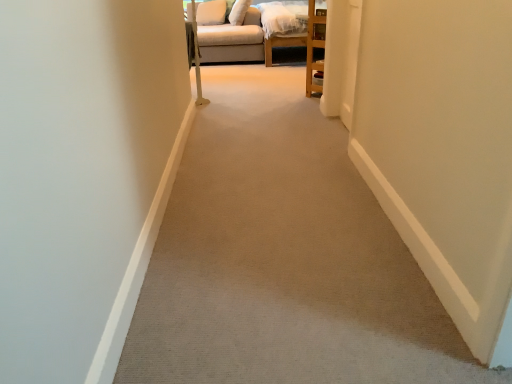
This screenshot has height=384, width=512. Find the location of `beige fabric couch at upper center`. beige fabric couch at upper center is located at coordinates (246, 48).

What is the approximate height of beige fabric couch at upper center?

beige fabric couch at upper center is 67.98 centimeters in height.

What do you see at coordinates (210, 12) in the screenshot?
I see `white fabric pillow at upper center, the second pillow viewed from the right` at bounding box center [210, 12].

In order to face beige carpet at center, should I rotate leftwards or rightwards?

To face it directly, rotate right by 2.169 degrees.

This screenshot has width=512, height=384. What do you see at coordinates (283, 258) in the screenshot?
I see `beige carpet at center` at bounding box center [283, 258].

I want to click on beige fabric couch at upper center, so click(x=246, y=48).

Choose the correct answer: Is beige fabric pillow at upper center, marked as the 2th pillow in a left-to-right arrangement, inside beige carpet at center or outside it?

beige fabric pillow at upper center, marked as the 2th pillow in a left-to-right arrangement, is spatially situated outside beige carpet at center.

Is beige fabric pillow at upper center, marked as the 2th pillow in a left-to-right arrangement, positioned in front of beige carpet at center?

No, it is behind beige carpet at center.

Does beige fabric pillow at upper center, which is the 1th pillow in right-to-left order, have a lesser width compared to beige carpet at center?

Yes, beige fabric pillow at upper center, which is the 1th pillow in right-to-left order, is thinner than beige carpet at center.

Which is more to the left, beige fabric pillow at upper center, marked as the 2th pillow in a left-to-right arrangement, or beige carpet at center?

beige fabric pillow at upper center, marked as the 2th pillow in a left-to-right arrangement, is more to the left.

Would you say white fabric pillow at upper center, the second pillow viewed from the right, is to the left or to the right of beige fabric pillow at upper center, marked as the 2th pillow in a left-to-right arrangement, in the picture?

white fabric pillow at upper center, the second pillow viewed from the right, is positioned on beige fabric pillow at upper center, marked as the 2th pillow in a left-to-right arrangement,'s left side.

Is white fabric pillow at upper center, marked as the 1th pillow in a left-to-right arrangement, situated inside beige fabric pillow at upper center, marked as the 2th pillow in a left-to-right arrangement, or outside?

white fabric pillow at upper center, marked as the 1th pillow in a left-to-right arrangement, is outside beige fabric pillow at upper center, marked as the 2th pillow in a left-to-right arrangement.

Identify the location of pillow below the beige fabric pillow at upper center, marked as the 2th pillow in a left-to-right arrangement (from a real-world perspective). The image size is (512, 384). (210, 12).

In the image, is white fabric pillow at upper center, marked as the 1th pillow in a left-to-right arrangement, positioned in front of or behind beige fabric pillow at upper center, marked as the 2th pillow in a left-to-right arrangement?

white fabric pillow at upper center, marked as the 1th pillow in a left-to-right arrangement, is positioned farther from the viewer than beige fabric pillow at upper center, marked as the 2th pillow in a left-to-right arrangement.

Starting from the beige carpet at center, which pillow is the 1st one to the left? Please provide its 2D coordinates.

[(239, 12)]

Between beige carpet at center and beige fabric pillow at upper center, marked as the 2th pillow in a left-to-right arrangement, which one has smaller size?

beige fabric pillow at upper center, marked as the 2th pillow in a left-to-right arrangement, is smaller.

Considering the points (215, 205) and (240, 3), which point is in front, point (215, 205) or point (240, 3)?

The point (215, 205) is more forward.

Would you say beige carpet at center is to the left or to the right of beige fabric pillow at upper center, marked as the 2th pillow in a left-to-right arrangement, in the picture?

From the image, it's evident that beige carpet at center is to the right of beige fabric pillow at upper center, marked as the 2th pillow in a left-to-right arrangement.

Does beige carpet at center contain beige fabric couch at upper center?

Actually, beige fabric couch at upper center is outside beige carpet at center.

In the scene shown: From a real-world perspective, is beige carpet at center physically located above or below beige fabric couch at upper center?

In terms of real-world spatial position, beige carpet at center is below beige fabric couch at upper center.

Considering the positions of objects beige carpet at center and beige fabric couch at upper center in the image provided, who is in front, beige carpet at center or beige fabric couch at upper center?

beige carpet at center is in front.

Is beige fabric couch at upper center at the back of beige carpet at center?

That's not correct — beige carpet at center is not looking away from beige fabric couch at upper center.

Which of these two, beige fabric couch at upper center or beige fabric pillow at upper center, marked as the 2th pillow in a left-to-right arrangement, is thinner?

Thinner between the two is beige fabric pillow at upper center, marked as the 2th pillow in a left-to-right arrangement.

From the image's perspective, would you say beige fabric couch at upper center is shown under beige fabric pillow at upper center, marked as the 2th pillow in a left-to-right arrangement?

Indeed, from the image's perspective, beige fabric couch at upper center is shown beneath beige fabric pillow at upper center, marked as the 2th pillow in a left-to-right arrangement.

Visually, is beige fabric couch at upper center positioned to the left or to the right of beige fabric pillow at upper center, marked as the 2th pillow in a left-to-right arrangement?

Based on their positions, beige fabric couch at upper center is located to the left of beige fabric pillow at upper center, marked as the 2th pillow in a left-to-right arrangement.

Is beige fabric couch at upper center bigger than beige fabric pillow at upper center, marked as the 2th pillow in a left-to-right arrangement?

Yes.

Is point (298, 37) less distant than point (234, 325)?

That is False.

Looking at this image, from their relative heights in the image, would you say beige fabric couch at upper center is taller or shorter than beige carpet at center?

Clearly, beige fabric couch at upper center is taller compared to beige carpet at center.

Is beige fabric couch at upper center placed right next to beige carpet at center?

No, beige fabric couch at upper center is not next to beige carpet at center.

Identify the location of path below the beige fabric couch at upper center (from the image's perspective). Image resolution: width=512 pixels, height=384 pixels. (283, 258).

Can you confirm if white fabric pillow at upper center, marked as the 1th pillow in a left-to-right arrangement, is bigger than beige fabric couch at upper center?

Actually, white fabric pillow at upper center, marked as the 1th pillow in a left-to-right arrangement, might be smaller than beige fabric couch at upper center.

How many degrees apart are the facing directions of white fabric pillow at upper center, marked as the 1th pillow in a left-to-right arrangement, and beige fabric couch at upper center?

78.1 degrees.

Considering the positions of points (199, 15) and (318, 52), is point (199, 15) farther from camera compared to point (318, 52)?

That is True.

Looking at their sizes, would you say white fabric pillow at upper center, the second pillow viewed from the right, is wider or thinner than beige fabric couch at upper center?

Clearly, white fabric pillow at upper center, the second pillow viewed from the right, has less width compared to beige fabric couch at upper center.

Locate an element on the screen. This screenshot has width=512, height=384. path on the right side of beige fabric pillow at upper center, marked as the 2th pillow in a left-to-right arrangement is located at coordinates (283, 258).

In order to click on pillow that is above the white fabric pillow at upper center, marked as the 1th pillow in a left-to-right arrangement (from a real-world perspective) in this screenshot , I will do `click(239, 12)`.

Estimate the real-world distances between objects in this image. Which object is further from beige fabric couch at upper center, white fabric pillow at upper center, the second pillow viewed from the right, or beige fabric pillow at upper center, which is the 1th pillow in right-to-left order?

Based on the image, beige fabric pillow at upper center, which is the 1th pillow in right-to-left order, appears to be further to beige fabric couch at upper center.

When comparing their distances from beige fabric pillow at upper center, which is the 1th pillow in right-to-left order, does beige fabric couch at upper center or white fabric pillow at upper center, the second pillow viewed from the right, seem further?

beige fabric couch at upper center.

Looking at the image, which one is located closer to beige fabric couch at upper center, beige carpet at center or beige fabric pillow at upper center, marked as the 2th pillow in a left-to-right arrangement?

beige fabric pillow at upper center, marked as the 2th pillow in a left-to-right arrangement, lies closer to beige fabric couch at upper center than the other object.

Estimate the real-world distances between objects in this image. Which object is further from beige carpet at center, beige fabric couch at upper center or white fabric pillow at upper center, marked as the 1th pillow in a left-to-right arrangement?

white fabric pillow at upper center, marked as the 1th pillow in a left-to-right arrangement.

When comparing their distances from white fabric pillow at upper center, marked as the 1th pillow in a left-to-right arrangement, does beige carpet at center or beige fabric pillow at upper center, marked as the 2th pillow in a left-to-right arrangement, seem further?

beige carpet at center is further to white fabric pillow at upper center, marked as the 1th pillow in a left-to-right arrangement.

Considering their positions, is white fabric pillow at upper center, the second pillow viewed from the right, positioned closer to beige fabric pillow at upper center, marked as the 2th pillow in a left-to-right arrangement, than beige carpet at center?

white fabric pillow at upper center, the second pillow viewed from the right, is positioned closer to the anchor beige fabric pillow at upper center, marked as the 2th pillow in a left-to-right arrangement.

Looking at the image, which one is located closer to white fabric pillow at upper center, the second pillow viewed from the right, beige carpet at center or beige fabric couch at upper center?

beige fabric couch at upper center lies closer to white fabric pillow at upper center, the second pillow viewed from the right, than the other object.

Which object lies further to the anchor point beige carpet at center, beige fabric pillow at upper center, which is the 1th pillow in right-to-left order, or beige fabric couch at upper center?

beige fabric pillow at upper center, which is the 1th pillow in right-to-left order, is positioned further to the anchor beige carpet at center.

I want to click on studio couch between beige carpet at center and white fabric pillow at upper center, marked as the 1th pillow in a left-to-right arrangement, along the z-axis, so click(x=246, y=48).

The height and width of the screenshot is (384, 512). I want to click on studio couch between beige carpet at center and beige fabric pillow at upper center, marked as the 2th pillow in a left-to-right arrangement, in the front-back direction, so 246,48.

Locate an element on the screen. pillow between beige carpet at center and white fabric pillow at upper center, the second pillow viewed from the right, along the z-axis is located at coordinates (239, 12).

Identify the location of pillow between beige fabric couch at upper center and white fabric pillow at upper center, the second pillow viewed from the right, from front to back. (239, 12).